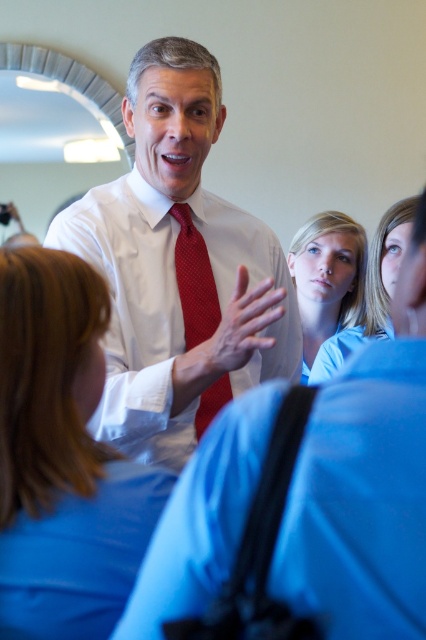
You are standing in the conference room and want to hand a document to the person wearing the blue fabric shirt at upper center and the red textured tie at center. Which one can you reach first without moving closer?

The blue fabric shirt at upper center is closer to you than the red textured tie at center, so you can reach the blue fabric shirt at upper center first.

You are organizing a costume party and need to ensure all accessories match the clothing. You have a white smooth shirt at center and a smooth red tie at center. Which item should you adjust the size of to make them proportionate?

The white smooth shirt at center is bigger than the smooth red tie at center. To make them proportionate, you should adjust the size of the smooth red tie at center to be larger so it matches the scale of the white smooth shirt at center.